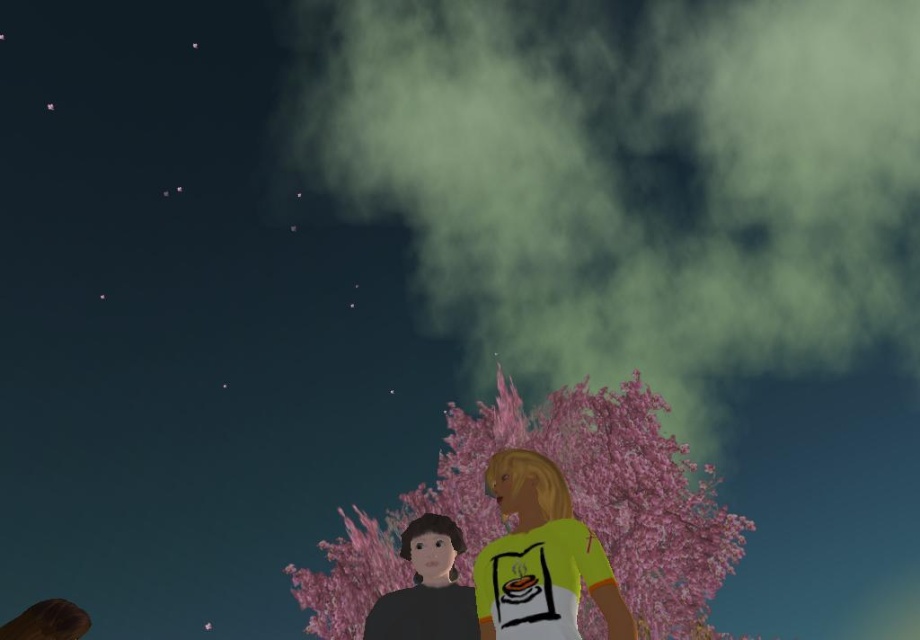
You are standing in the nighttime scene with the two characters. You want to walk from the point where the character on the left is standing to the point where the character on the right is standing. Which direction should you move to go from point (599,413) to point (447,580)?

To move from point (599,413) to point (447,580), you should move towards the right and downward since point (447,580) is to the right and lower than point (599,413).

You are an observer looking at the nighttime scene. You notice the pink matte tree at center and the yellow matte shirt at center. Which object is positioned lower in the image?

The pink matte tree at center is positioned below the yellow matte shirt at center, so it is lower in the image.